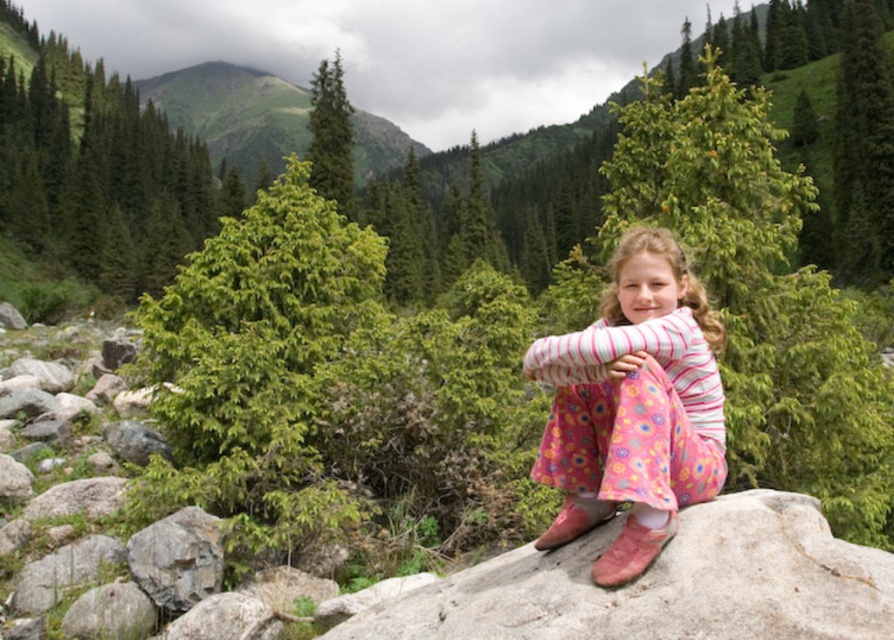
You are a photographer trying to capture the pink floral dress at center in the foreground. Based on the coordinates provided, where should you position the focus point of your camera to ensure the dress is in sharp focus?

The pink floral dress at center is located at coordinates point (633,406), so you should position the focus point of your camera at that coordinate to ensure the dress is in sharp focus.

Consider the image. You are a photographer trying to capture the pink floral dress at center and the green matte pine at upper center in a single shot. Based on their widths, which object would require you to adjust your camera angle more to ensure both are fully visible in the frame?

The green matte pine at upper center has a greater width than the pink floral dress at center, so it would require more adjustment to the camera angle to ensure both are fully visible in the frame.